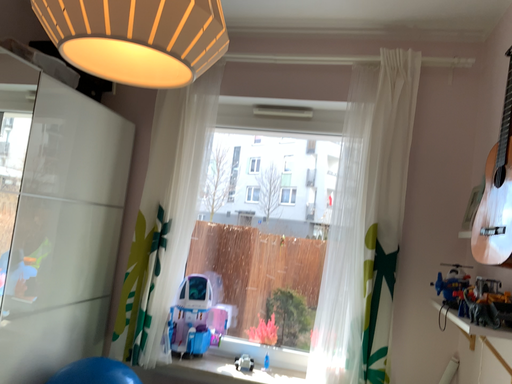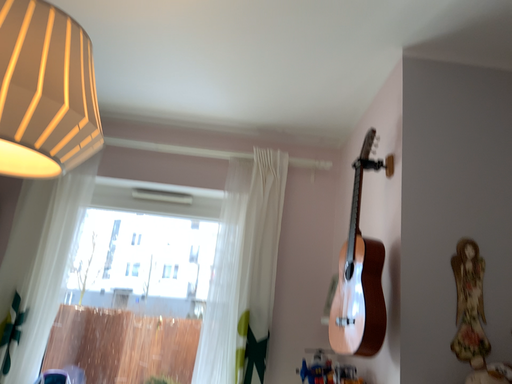
Question: How did the camera likely rotate when shooting the video?

Choices:
 (A) rotated downward
 (B) rotated upward

Answer: (B)